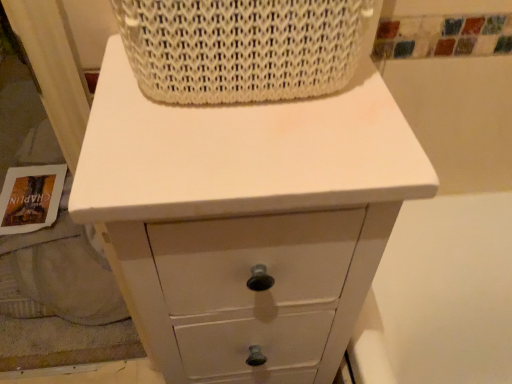
Find the location of `vacant area on top of white matte chest of drawers at center (from a real-world perspective)`. vacant area on top of white matte chest of drawers at center (from a real-world perspective) is located at coordinates (240, 130).